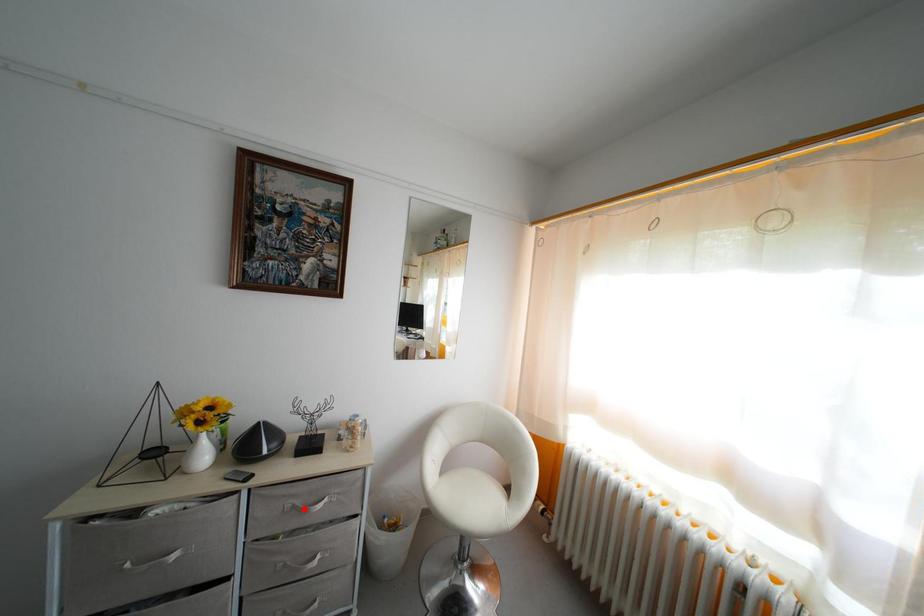
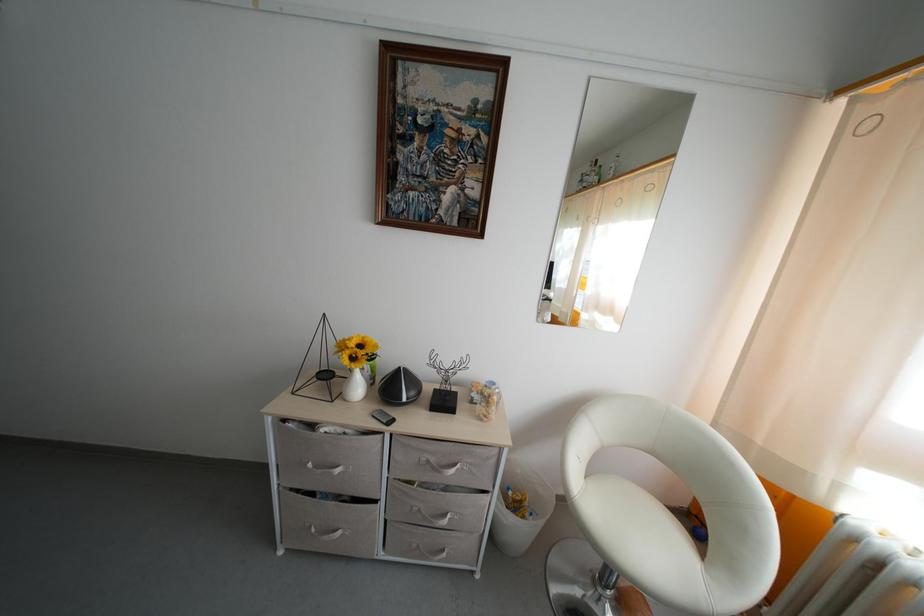
Question: I am providing you with two images of the same scene from different viewpoints. Given a red point in image1, look at the same physical point in image2. Is it:

Choices:
 (A) Closer to the viewpoint
 (B) Farther from the viewpoint

Answer: (B)